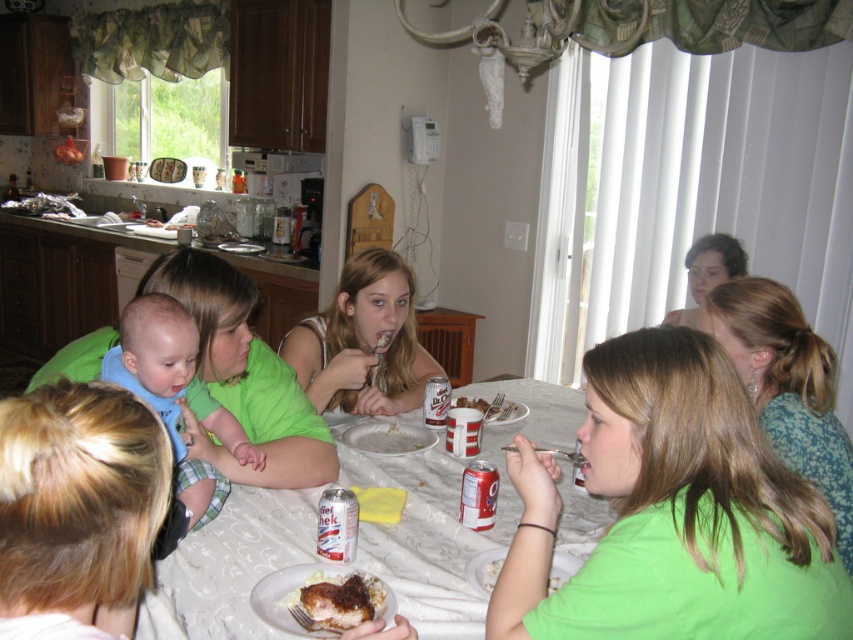
Question: Which object is closer to the camera taking this photo?

Choices:
 (A) green matte shirt at upper right
 (B) diet coke can at center
 (C) white paper plate at center

Answer: (A)

Question: Does white paper plate at lower center have a larger size compared to matte green shirt at center?

Choices:
 (A) no
 (B) yes

Answer: (B)

Question: Is teal floral blouse at right closer to camera compared to diet coke can at center?

Choices:
 (A) no
 (B) yes

Answer: (B)

Question: Estimate the real-world distances between objects in this image. Which object is closer to the matte green shirt at upper right?

Choices:
 (A) green matte shirt at upper right
 (B) white paper plate at lower center
 (C) blue soft fabric baby at left

Answer: (B)

Question: Where is white matte can at center located in relation to white paper plate at center in the image?

Choices:
 (A) above
 (B) below

Answer: (B)

Question: Which point is farther from the camera taking this photo?

Choices:
 (A) (219, 497)
 (B) (485, 408)
 (C) (824, 388)

Answer: (B)